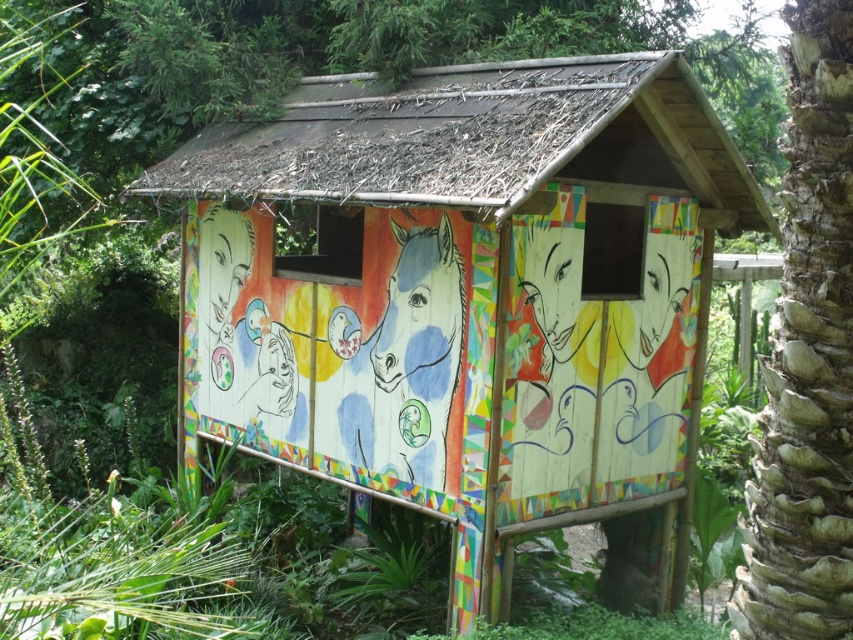
Question: Which point is farther to the camera?

Choices:
 (A) wooden hut at center
 (B) brown textured palm tree at right

Answer: (A)

Question: Which object appears farthest from the camera in this image?

Choices:
 (A) brown textured palm tree at right
 (B) wooden hut at center

Answer: (B)

Question: Does wooden hut at center lie in front of brown textured palm tree at right?

Choices:
 (A) yes
 (B) no

Answer: (B)

Question: Does wooden hut at center have a lesser width compared to brown textured palm tree at right?

Choices:
 (A) no
 (B) yes

Answer: (A)

Question: Does wooden hut at center come behind brown textured palm tree at right?

Choices:
 (A) no
 (B) yes

Answer: (B)